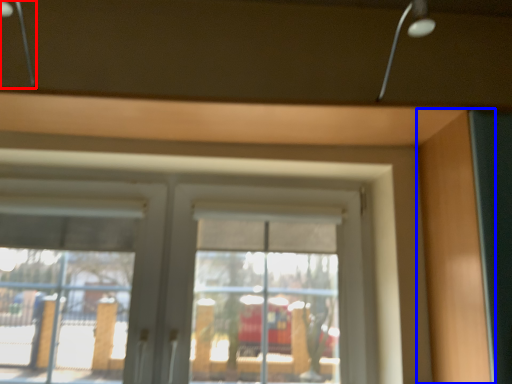
Question: Among these objects, which one is nearest to the camera, lamp (highlighted by a red box) or garage door (highlighted by a blue box)?

Choices:
 (A) lamp
 (B) garage door

Answer: (A)